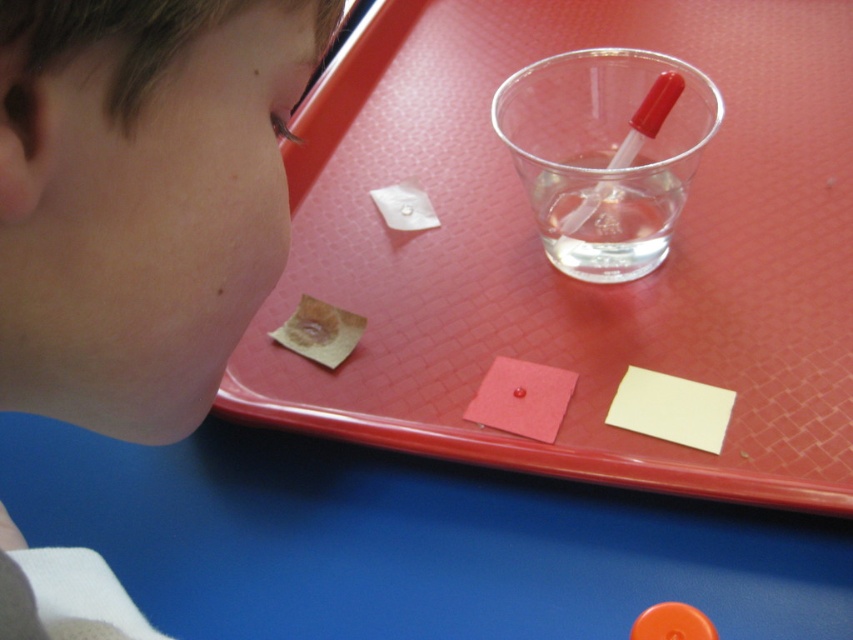
You are a teacher setting up an experiment for a class. You have a transparent plastic straw at upper center and an orange matte button at lower right. Which object should you choose if you need a larger item for demonstration purposes?

The transparent plastic straw at upper center is larger in size than the orange matte button at lower right, so you should choose the transparent plastic straw at upper center for the demonstration.

You are a child trying to reach the orange matte button at lower right on the tray. The transparent plastic cup at upper right is in the way. Can you move the cup to access the button?

The orange matte button at lower right is behind the transparent plastic cup at upper right, so you can move the cup to access the button.

You are a teacher observing a science experiment setup. The experiment requires placing the orange matte button at lower right under the transparent plastic straw at upper center to catch dripping liquid. Is the current arrangement suitable for this purpose?

The transparent plastic straw at upper center is above the orange matte button at lower right, so the current arrangement is suitable for catching dripping liquid since the button is positioned below the straw.